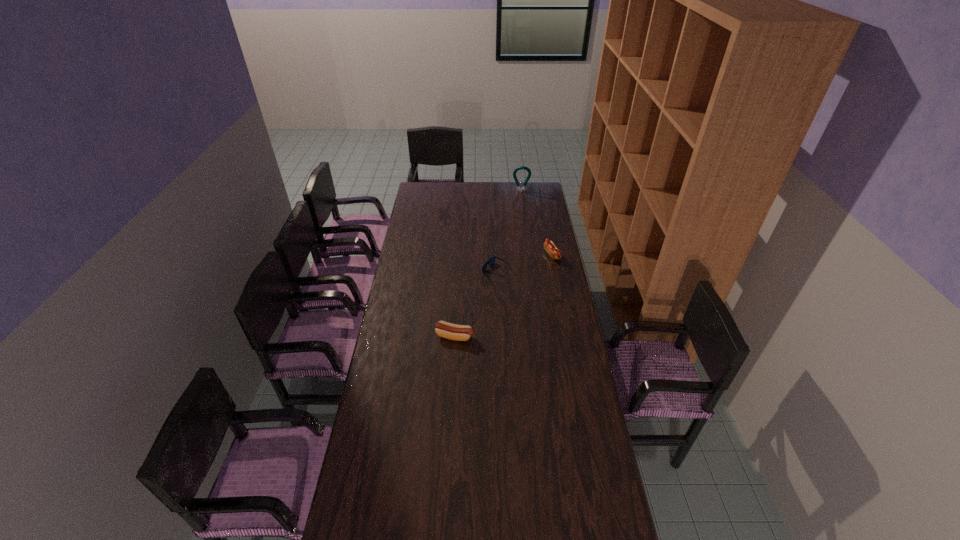
The height and width of the screenshot is (540, 960). Find the location of `free region located on the back of the left sausage`. free region located on the back of the left sausage is located at coordinates (457, 294).

The height and width of the screenshot is (540, 960). I want to click on vacant space situated at the front of the second object from left to right showing the lenses, so click(431, 271).

The height and width of the screenshot is (540, 960). In order to click on free location located at the front of the second object from left to right showing the lenses in this screenshot , I will do `click(460, 271)`.

Image resolution: width=960 pixels, height=540 pixels. What are the coordinates of `blank space located 0.370m at the front of the second object from left to right showing the lenses` in the screenshot? It's located at (410, 271).

The width and height of the screenshot is (960, 540). I want to click on object that is at the far edge, so click(522, 189).

Locate an element on the screen. bottle opener at the right edge is located at coordinates (522, 189).

Locate an element on the screen. The height and width of the screenshot is (540, 960). sausage located at the right edge is located at coordinates (549, 246).

Locate an element on the screen. The width and height of the screenshot is (960, 540). object that is at the far right corner is located at coordinates (522, 189).

Where is `free space at the left edge of the desktop`? Image resolution: width=960 pixels, height=540 pixels. free space at the left edge of the desktop is located at coordinates (429, 221).

The height and width of the screenshot is (540, 960). I want to click on vacant space at the right edge of the desktop, so click(580, 459).